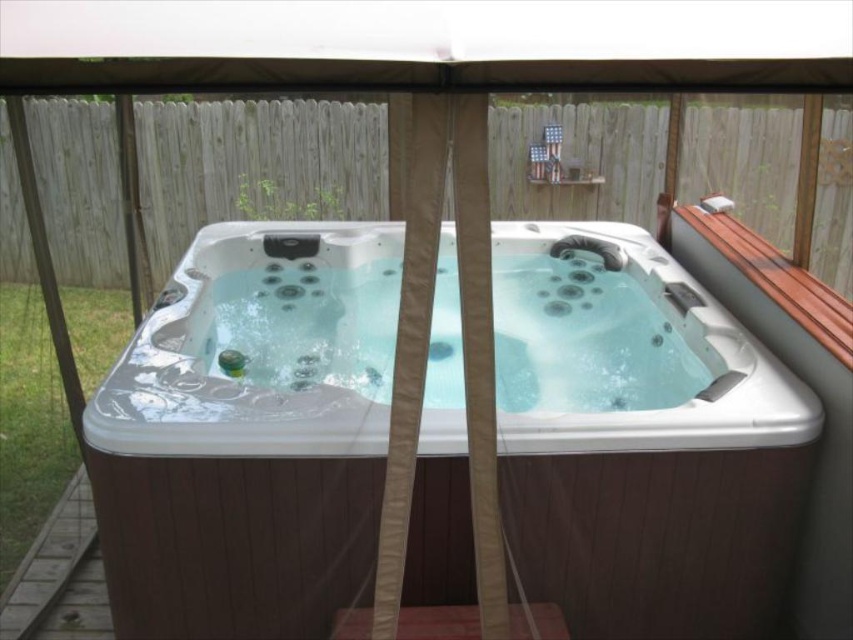
Question: Does white glossy hot tub at center come in front of brown wooden deck at lower left?

Choices:
 (A) no
 (B) yes

Answer: (B)

Question: Which point is closer to the camera?

Choices:
 (A) (15, 637)
 (B) (573, 458)

Answer: (B)

Question: Is white glossy hot tub at center thinner than brown wooden deck at lower left?

Choices:
 (A) yes
 (B) no

Answer: (B)

Question: Is white glossy hot tub at center to the left of brown wooden deck at lower left from the viewer's perspective?

Choices:
 (A) no
 (B) yes

Answer: (A)